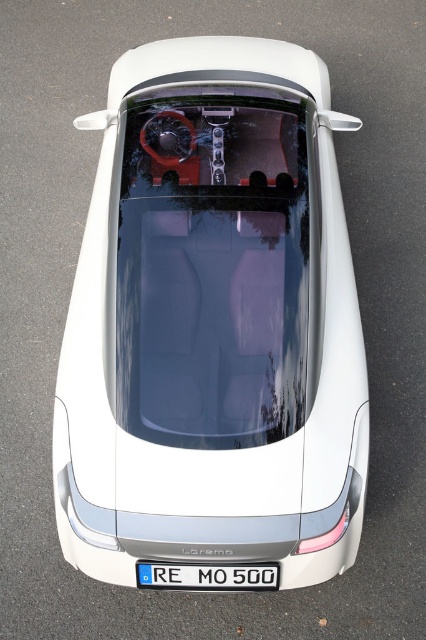
Question: Is white matte car at center thinner than white plastic license plate at center?

Choices:
 (A) yes
 (B) no

Answer: (B)

Question: Estimate the real-world distances between objects in this image. Which object is closer to the transparent glass windshield at center?

Choices:
 (A) white plastic license plate at center
 (B) white matte car at center

Answer: (B)

Question: Where is white matte car at center located in relation to transparent glass windshield at center in the image?

Choices:
 (A) above
 (B) below

Answer: (B)

Question: From the image, what is the correct spatial relationship of white matte car at center in relation to transparent glass windshield at center?

Choices:
 (A) below
 (B) above

Answer: (A)

Question: Which point is closer to the camera taking this photo?

Choices:
 (A) (294, 365)
 (B) (189, 467)
 (C) (252, 579)

Answer: (B)

Question: Estimate the real-world distances between objects in this image. Which object is closer to the transparent glass windshield at center?

Choices:
 (A) white plastic license plate at center
 (B) white matte car at center

Answer: (B)